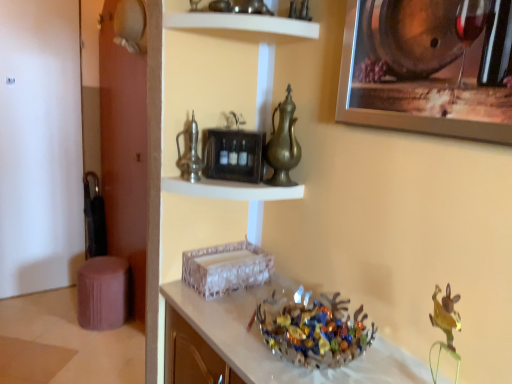
This screenshot has height=384, width=512. What are the coordinates of `free spot above metallic silver clock at upper center, which is counted as the 2th shelf, starting from the top (from a real-world perspective)` in the screenshot? It's located at (240, 181).